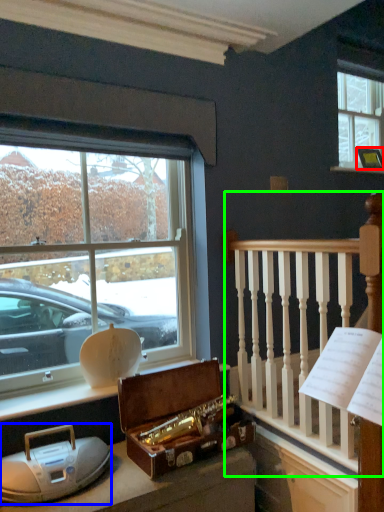
Question: Which object is positioned farthest from picture frame (highlighted by a red box)? Select from artifact (highlighted by a blue box) and rail (highlighted by a green box).

Choices:
 (A) artifact
 (B) rail

Answer: (A)